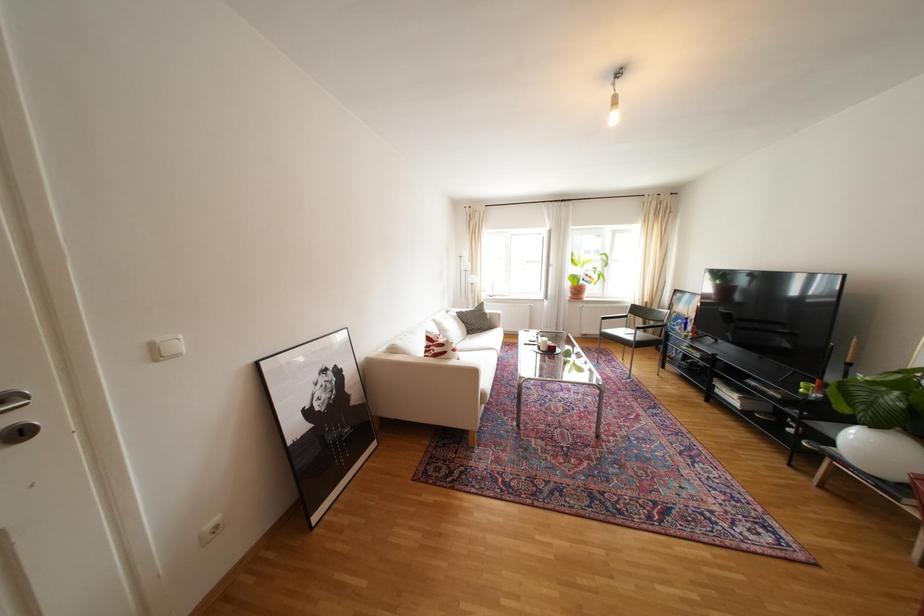
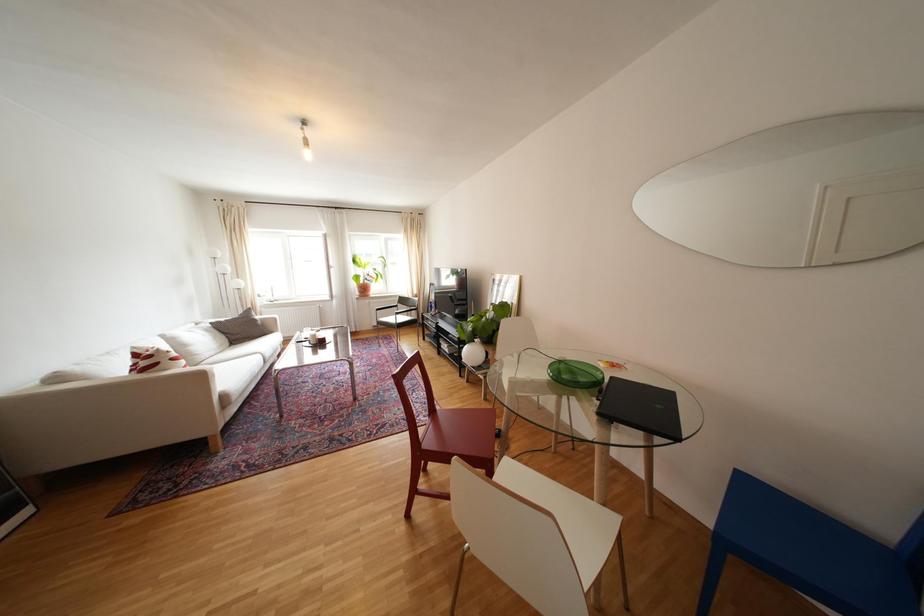
Question: The images are taken continuously from a first-person perspective. In which direction is your viewpoint rotating?

Choices:
 (A) Left
 (B) Right
 (C) Up
 (D) Down

Answer: (B)